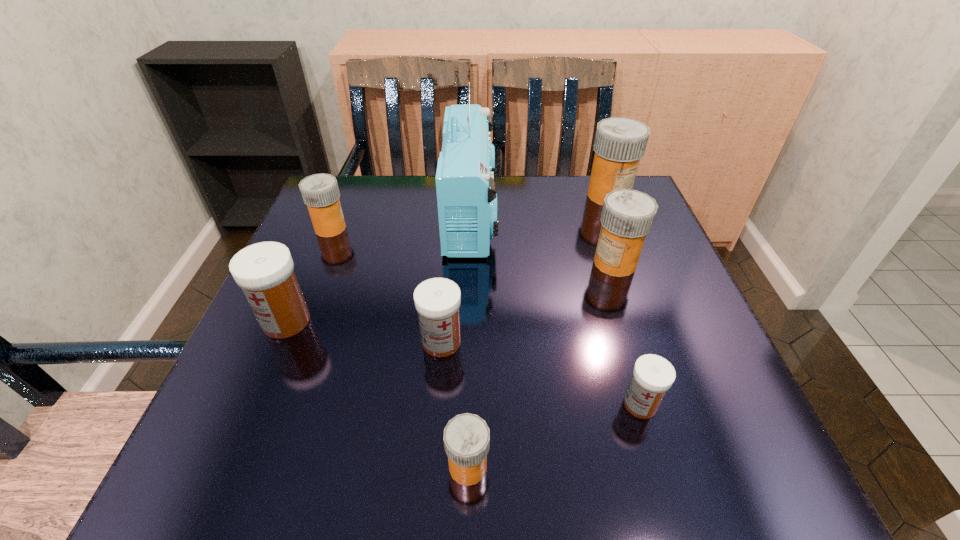
Image resolution: width=960 pixels, height=540 pixels. Find the location of `the rightmost white medicine`. the rightmost white medicine is located at coordinates (653, 375).

You are a GUI agent. You are given a task and a screenshot of the screen. Output one action in this format:
    pyautogui.click(x=<x>, y=<y>)
    Task: Click on the sixth farthest medicine
    
    Given the screenshot: What is the action you would take?
    pyautogui.click(x=653, y=375)

Image resolution: width=960 pixels, height=540 pixels. In order to click on the smallest orange medicine in this screenshot , I will do `click(466, 438)`.

Where is `the nearest medicine`? The width and height of the screenshot is (960, 540). the nearest medicine is located at coordinates (466, 438).

Find the location of `vacant space located on the front-facing side of the blue radio receiver`. vacant space located on the front-facing side of the blue radio receiver is located at coordinates (574, 215).

At what (x,y) coordinates should I click in order to perform the action: click on vacant space situated on the label side of the seventh shortest object. Please return your answer as a coordinate pair (x, y). The width and height of the screenshot is (960, 540). Looking at the image, I should click on (646, 292).

The height and width of the screenshot is (540, 960). What are the coordinates of `vacant space located on the label side of the second nearest orange medicine` in the screenshot? It's located at (465, 263).

This screenshot has width=960, height=540. I want to click on free space located 0.260m on the label side of the second nearest orange medicine, so click(x=469, y=263).

The width and height of the screenshot is (960, 540). Find the location of `vacant space located on the label side of the second nearest orange medicine`. vacant space located on the label side of the second nearest orange medicine is located at coordinates (450, 263).

Locate an element on the screen. vacant space located 0.140m on the front of the biggest white medicine is located at coordinates (248, 412).